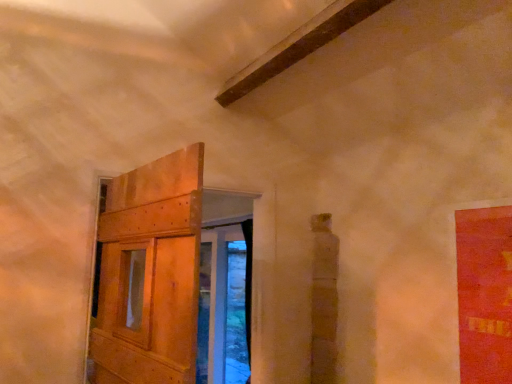
Identify the location of wooden door at left. This screenshot has height=384, width=512. (150, 273).

The image size is (512, 384). What do you see at coordinates (150, 273) in the screenshot?
I see `wooden door at left` at bounding box center [150, 273].

Measure the distance between point (128,245) and camera.

A distance of 5.20 feet exists between point (128,245) and camera.

You are a GUI agent. You are given a task and a screenshot of the screen. Output one action in this format:
    pyautogui.click(x=<x>, y=<y>)
    Task: Click on the wooden door at left
    The width and height of the screenshot is (512, 384).
    Given the screenshot: What is the action you would take?
    pos(150,273)